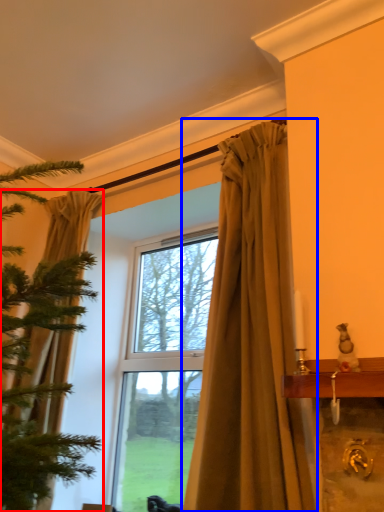
Question: Which of the following is the farthest to the observer, curtain (highlighted by a red box) or curtain (highlighted by a blue box)?

Choices:
 (A) curtain
 (B) curtain

Answer: (A)